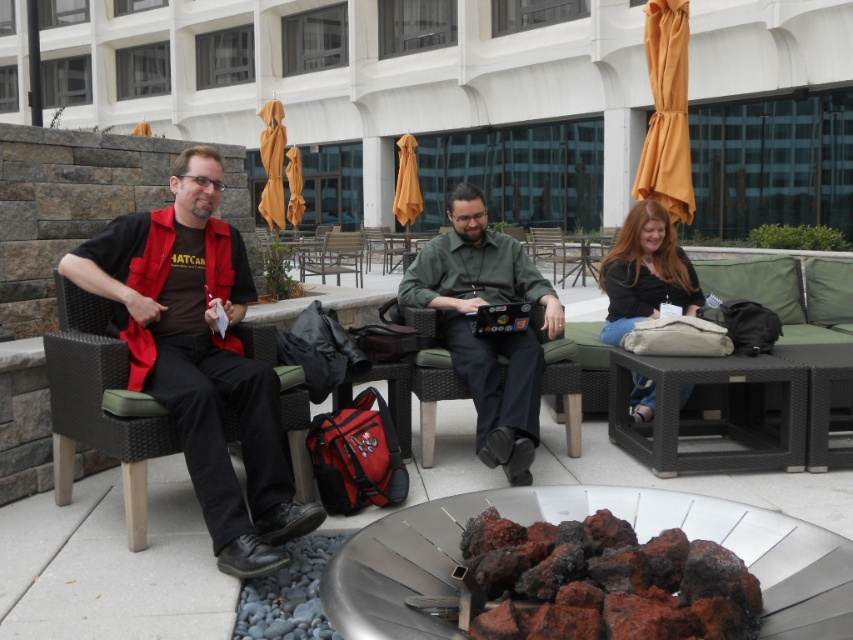
Question: Is matte black vest at left wider than green matte shirt at center?

Choices:
 (A) yes
 (B) no

Answer: (A)

Question: Does charcoal-textured rocks at center have a larger size compared to green matte shirt at center?

Choices:
 (A) no
 (B) yes

Answer: (A)

Question: Which point is closer to the camera?

Choices:
 (A) (413, 300)
 (B) (172, 419)
 (C) (485, 522)
 (D) (643, 312)

Answer: (C)

Question: Which of these objects is positioned farthest from the matte black vest at left?

Choices:
 (A) charcoal-textured rocks at center
 (B) matte black shirt at center

Answer: (B)

Question: Does charcoal-textured rocks at center appear on the left side of green matte shirt at center?

Choices:
 (A) no
 (B) yes

Answer: (A)

Question: Which object is closer to the camera taking this photo?

Choices:
 (A) green matte shirt at center
 (B) matte black vest at left

Answer: (B)